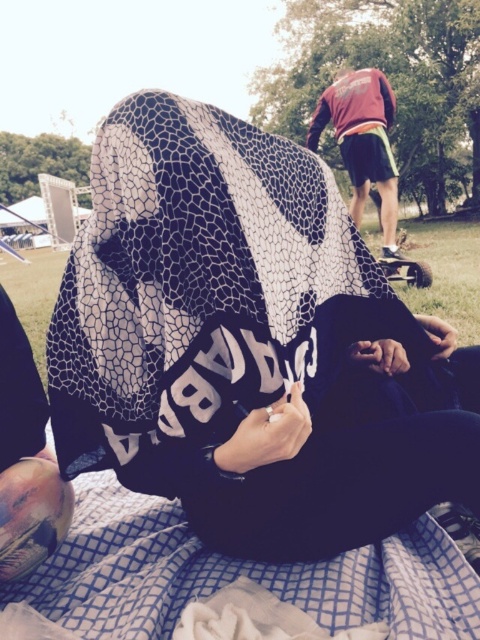
You are a skateboarder who wants to choose a skateboard to ride. You see a matte black skateboard at upper right and a metallic silver skateboard at center. Which one is taller?

The matte black skateboard at upper right is taller than the metallic silver skateboard at center.

You are planning to place a metallic silver skateboard at center on top of the blue checkered fabric at lower center. Will the entire skateboard fit within the fabric?

The blue checkered fabric at lower center has a larger width than the metallic silver skateboard at center, so the entire skateboard will fit within the fabric.

You are setting up a picnic area and need to place both the blue checkered fabric at lower center and the metallic silver skateboard at center. Given their sizes, which object should you place first to ensure they both fit in the space?

The blue checkered fabric at lower center is shorter than the metallic silver skateboard at center, so you should place the metallic silver skateboard at center first to accommodate its larger size before positioning the smaller blue checkered fabric at lower center.